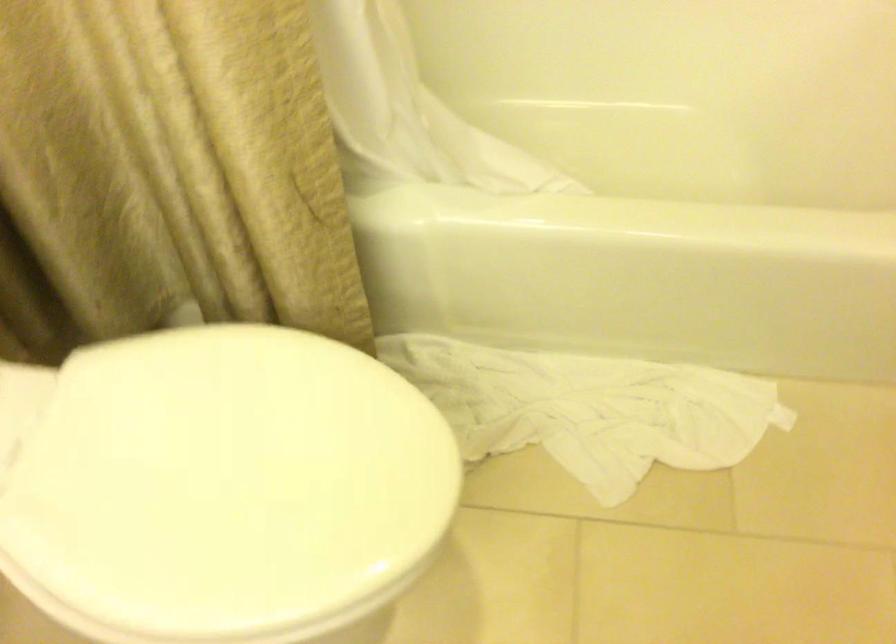
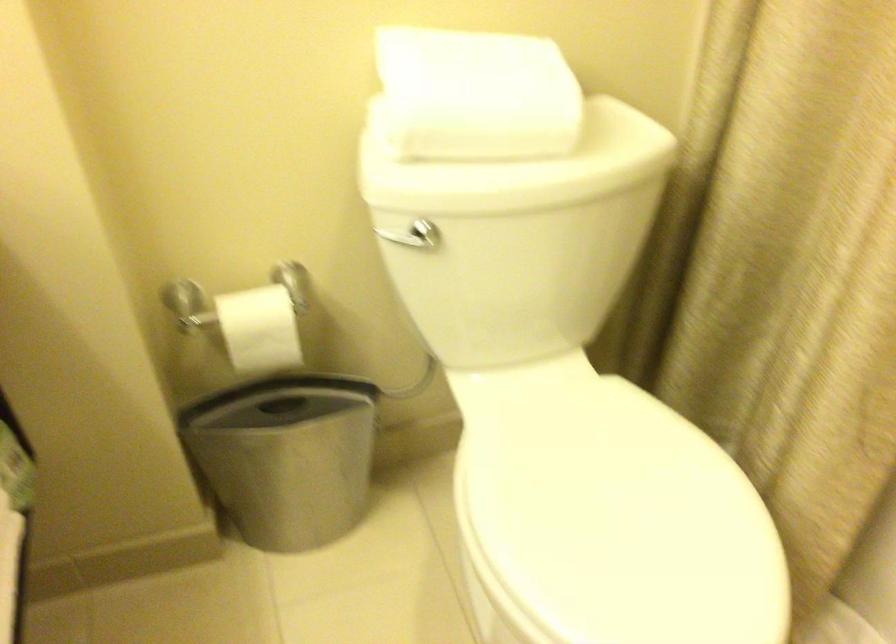
Question: The camera is either moving clockwise (left) or counter-clockwise (right) around the object. The first image is from the beginning of the video and the second image is from the end. Is the camera moving left or right when shooting the video?

Choices:
 (A) Left
 (B) Right

Answer: (B)